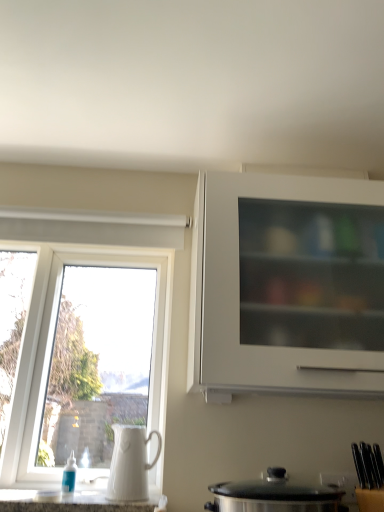
Question: Is stainless steel pot at lower center taller than white matte cabinet at upper right?

Choices:
 (A) no
 (B) yes

Answer: (A)

Question: Can you see stainless steel pot at lower center touching white matte cabinet at upper right?

Choices:
 (A) yes
 (B) no

Answer: (B)

Question: From the image's perspective, is stainless steel pot at lower center below white matte cabinet at upper right?

Choices:
 (A) no
 (B) yes

Answer: (B)

Question: From the image's perspective, would you say stainless steel pot at lower center is positioned over white matte cabinet at upper right?

Choices:
 (A) yes
 (B) no

Answer: (B)

Question: Is stainless steel pot at lower center facing away from white matte cabinet at upper right?

Choices:
 (A) no
 (B) yes

Answer: (A)

Question: Considering the positions of white ceramic jug at left and white glossy countertop at lower center in the image, is white ceramic jug at left bigger or smaller than white glossy countertop at lower center?

Choices:
 (A) big
 (B) small

Answer: (B)

Question: Considering the positions of white ceramic jug at left and white glossy countertop at lower center in the image, is white ceramic jug at left wider or thinner than white glossy countertop at lower center?

Choices:
 (A) thin
 (B) wide

Answer: (A)

Question: From a real-world perspective, relative to white glossy countertop at lower center, is white ceramic jug at left vertically above or below?

Choices:
 (A) above
 (B) below

Answer: (A)

Question: From the image's perspective, is white ceramic jug at left located above or below white glossy countertop at lower center?

Choices:
 (A) above
 (B) below

Answer: (A)

Question: Choose the correct answer: Is white plastic window at left inside stainless steel pot at lower center or outside it?

Choices:
 (A) inside
 (B) outside

Answer: (B)

Question: Would you say white plastic window at left is to the left or to the right of stainless steel pot at lower center in the picture?

Choices:
 (A) left
 (B) right

Answer: (A)

Question: From the image's perspective, is white plastic window at left above or below stainless steel pot at lower center?

Choices:
 (A) above
 (B) below

Answer: (A)

Question: From a real-world perspective, is white plastic window at left above or below stainless steel pot at lower center?

Choices:
 (A) above
 (B) below

Answer: (A)

Question: In the image, is white plastic window at left on the left side or the right side of white ceramic jug at left?

Choices:
 (A) right
 (B) left

Answer: (B)

Question: Is point (59, 218) positioned closer to the camera than point (137, 487)?

Choices:
 (A) farther
 (B) closer

Answer: (A)